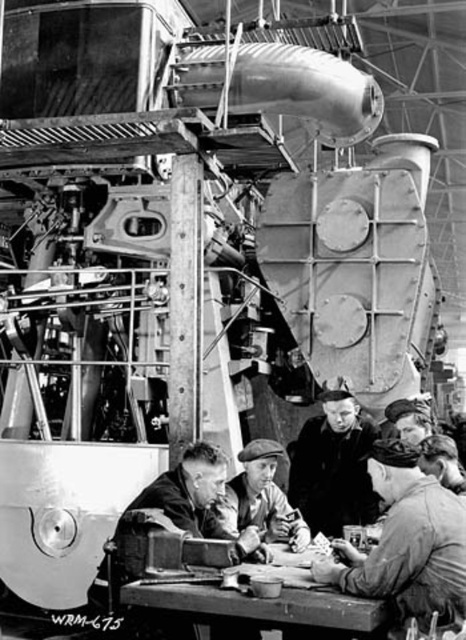
You are an observer standing in front of the industrial machinery. You notice two items at the center of the scene. Which one is bigger between the dark gray uniform at center and the dark fabric cap at center?

The dark gray uniform at center is larger in size than the dark fabric cap at center.